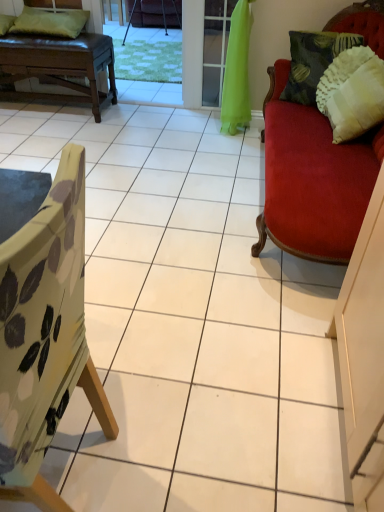
In order to face brown leather bench at upper left, should I rotate leftwards or rightwards?

To face it directly, rotate left by 19.312 degrees.

This screenshot has width=384, height=512. Describe the element at coordinates (129, 22) in the screenshot. I see `metallic tripod at center, which appears as the second chair when ordered from the bottom` at that location.

Measure the distance between green fabric pillow at upper left, which is counted as the 3th pillow, starting from the right, and camera.

3.03 meters.

You are a GUI agent. You are given a task and a screenshot of the screen. Output one action in this format:
    pyautogui.click(x=<x>, y=<y>)
    Task: Click on the brown leather bench at upper left
    Image resolution: width=384 pixels, height=512 pixels.
    Given the screenshot: What is the action you would take?
    pyautogui.click(x=57, y=66)

Is dark green textured pillow at upper right, the second pillow positioned from the left, closer to the viewer compared to floral fabric chair at left, which appears as the first chair when ordered from the bottom?

No.

Is dark green textured pillow at upper right, the second pillow positioned from the right, not near floral fabric chair at left, the 2th chair from the back?

Yes, dark green textured pillow at upper right, the second pillow positioned from the right, and floral fabric chair at left, the 2th chair from the back, are located far from each other.

Looking at their sizes, would you say dark green textured pillow at upper right, the second pillow positioned from the right, is wider or thinner than floral fabric chair at left, the first chair positioned from the front?

In the image, dark green textured pillow at upper right, the second pillow positioned from the right, appears to be more narrow than floral fabric chair at left, the first chair positioned from the front.

From a real-world perspective, is dark green textured pillow at upper right, the second pillow positioned from the left, located beneath floral fabric chair at left, the 2th chair from the back?

Actually, dark green textured pillow at upper right, the second pillow positioned from the left, is physically above floral fabric chair at left, the 2th chair from the back, in the real world.

Which object is positioned more to the right, green fabric screen door at center or green fabric pillow at upper left, which is counted as the 3th pillow, starting from the right?

From the viewer's perspective, green fabric screen door at center appears more on the right side.

Which of these two, green fabric screen door at center or green fabric pillow at upper left, which is counted as the 3th pillow, starting from the right, is smaller?

Smaller between the two is green fabric screen door at center.

Could you tell me if green fabric screen door at center is facing green fabric pillow at upper left, which ranks as the 1th pillow in left-to-right order?

No, green fabric screen door at center is not oriented towards green fabric pillow at upper left, which ranks as the 1th pillow in left-to-right order.

Which object is positioned more to the right, green fabric pillow at upper left, which is counted as the 3th pillow, starting from the right, or metallic tripod at center, the first chair from the back?

→ metallic tripod at center, the first chair from the back.

Is metallic tripod at center, placed as the 2th chair when sorted from front to back, located within green fabric pillow at upper left, which is counted as the 3th pillow, starting from the right?

Actually, metallic tripod at center, placed as the 2th chair when sorted from front to back, is outside green fabric pillow at upper left, which is counted as the 3th pillow, starting from the right.

You are a GUI agent. You are given a task and a screenshot of the screen. Output one action in this format:
    pyautogui.click(x=<x>, y=<y>)
    Task: Click on the chair above the green fabric pillow at upper left, which is counted as the 3th pillow, starting from the right (from the image's perspective)
    The width and height of the screenshot is (384, 512).
    Given the screenshot: What is the action you would take?
    pyautogui.click(x=129, y=22)

Can you tell me how much green fabric pillow at upper left, which is counted as the 3th pillow, starting from the right, and metallic tripod at center, placed as the 2th chair when sorted from front to back, differ in facing direction?

The facing directions of green fabric pillow at upper left, which is counted as the 3th pillow, starting from the right, and metallic tripod at center, placed as the 2th chair when sorted from front to back, are 4.57 degrees apart.

Could you tell me if green fabric screen door at center is turned towards white textured pillow at upper right, the first pillow in the right-to-left sequence?

No, green fabric screen door at center is not aimed at white textured pillow at upper right, the first pillow in the right-to-left sequence.

Are green fabric screen door at center and white textured pillow at upper right, the first pillow in the right-to-left sequence, located far from each other?

They are positioned close to each other.

Based on the photo, does green fabric screen door at center lie behind white textured pillow at upper right, the third pillow positioned from the left?

Yes, green fabric screen door at center is behind white textured pillow at upper right, the third pillow positioned from the left.

Locate an element on the screen. The image size is (384, 512). the 1st pillow above the green fabric screen door at center (from a real-world perspective) is located at coordinates (352, 93).

Which object is positioned more to the left, green fabric screen door at center or metallic tripod at center, the first chair from the back?

metallic tripod at center, the first chair from the back.

Identify the location of chair behind the green fabric screen door at center. The image size is (384, 512). (129, 22).

Considering the sizes of objects green fabric screen door at center and metallic tripod at center, the first chair positioned from the top, in the image provided, who is wider, green fabric screen door at center or metallic tripod at center, the first chair positioned from the top,?

metallic tripod at center, the first chair positioned from the top, is wider.

Is green fabric screen door at center far from metallic tripod at center, the first chair from the back?

green fabric screen door at center is far away from metallic tripod at center, the first chair from the back.

From a real-world perspective, is floral fabric chair at left, which appears as the first chair when ordered from the bottom, positioned above or below brown leather bench at upper left?

In terms of real-world spatial position, floral fabric chair at left, which appears as the first chair when ordered from the bottom, is above brown leather bench at upper left.

What's the angular difference between floral fabric chair at left, the first chair positioned from the front, and brown leather bench at upper left's facing directions?

They differ by 92.1 degrees in their facing directions.

From the image's perspective, would you say floral fabric chair at left, the 2th chair from the back, is shown under brown leather bench at upper left?

Correct, floral fabric chair at left, the 2th chair from the back, appears lower than brown leather bench at upper left in the image.

From the image's perspective, between metallic tripod at center, the first chair positioned from the top, and brown leather bench at upper left, who is located below?

brown leather bench at upper left is shown below in the image.

Is the position of metallic tripod at center, the first chair from the back, more distant than that of brown leather bench at upper left?

Yes, metallic tripod at center, the first chair from the back, is further from the camera.

Between point (176, 15) and point (71, 44), which one is positioned behind?

Point (176, 15)

Is metallic tripod at center, the first chair from the back, bigger or smaller than brown leather bench at upper left?

Clearly, metallic tripod at center, the first chair from the back, is smaller in size than brown leather bench at upper left.

At what (x,y) coordinates should I click in order to perform the action: click on the 2nd chair to the left of the dark green textured pillow at upper right, the second pillow positioned from the left, starting your count from the anchor. Please return your answer as a coordinate pair (x, y). The height and width of the screenshot is (512, 384). Looking at the image, I should click on (45, 335).

I want to click on screen door on the right of green fabric pillow at upper left, which ranks as the 1th pillow in left-to-right order, so click(215, 48).

Looking at the image, which one is located further to white textured pillow at upper right, the first pillow in the right-to-left sequence, floral fabric chair at left, the first chair positioned from the front, or green fabric pillow at upper left, which ranks as the 1th pillow in left-to-right order?

The object further to white textured pillow at upper right, the first pillow in the right-to-left sequence, is green fabric pillow at upper left, which ranks as the 1th pillow in left-to-right order.

Which object lies nearer to the anchor point brown leather bench at upper left, white textured pillow at upper right, the first pillow in the right-to-left sequence, or green fabric pillow at upper left, which is counted as the 3th pillow, starting from the right?

green fabric pillow at upper left, which is counted as the 3th pillow, starting from the right.

Looking at this image, looking at the image, which one is located closer to green fabric screen door at center, metallic tripod at center, placed as the 2th chair when sorted from front to back, or green fabric pillow at upper left, which ranks as the 1th pillow in left-to-right order?

The object closer to green fabric screen door at center is green fabric pillow at upper left, which ranks as the 1th pillow in left-to-right order.

Estimate the real-world distances between objects in this image. Which object is closer to floral fabric chair at left, the first chair positioned from the front, green fabric pillow at upper left, which is counted as the 3th pillow, starting from the right, or green fabric screen door at center?

green fabric screen door at center.

Considering their positions, is dark green textured pillow at upper right, the second pillow positioned from the left, positioned closer to brown leather bench at upper left than green fabric pillow at upper left, which is counted as the 3th pillow, starting from the right?

Among the two, green fabric pillow at upper left, which is counted as the 3th pillow, starting from the right, is located nearer to brown leather bench at upper left.

Which object lies further to the anchor point floral fabric chair at left, placed as the 2th chair when sorted from top to bottom, green fabric screen door at center or brown leather bench at upper left?

brown leather bench at upper left.

Estimate the real-world distances between objects in this image. Which object is closer to dark green textured pillow at upper right, the second pillow positioned from the right, green fabric screen door at center or floral fabric chair at left, which appears as the first chair when ordered from the bottom?

green fabric screen door at center is closer to dark green textured pillow at upper right, the second pillow positioned from the right.

Which object lies nearer to the anchor point white textured pillow at upper right, the third pillow positioned from the left, brown leather bench at upper left or dark green textured pillow at upper right, the second pillow positioned from the right?

dark green textured pillow at upper right, the second pillow positioned from the right, is positioned closer to the anchor white textured pillow at upper right, the third pillow positioned from the left.

You are a GUI agent. You are given a task and a screenshot of the screen. Output one action in this format:
    pyautogui.click(x=<x>, y=<y>)
    Task: Click on the screen door between white textured pillow at upper right, the first pillow in the right-to-left sequence, and metallic tripod at center, placed as the 2th chair when sorted from front to back, in the front-back direction
    This screenshot has height=512, width=384.
    Given the screenshot: What is the action you would take?
    pyautogui.click(x=215, y=48)

Locate an element on the screen. The image size is (384, 512). screen door positioned between dark green textured pillow at upper right, the second pillow positioned from the right, and metallic tripod at center, the first chair from the back, from near to far is located at coordinates (215, 48).

Where is `screen door between brown leather bench at upper left and white textured pillow at upper right, the first pillow in the right-to-left sequence, in the horizontal direction`? Image resolution: width=384 pixels, height=512 pixels. screen door between brown leather bench at upper left and white textured pillow at upper right, the first pillow in the right-to-left sequence, in the horizontal direction is located at coordinates (215, 48).

I want to click on table between floral fabric chair at left, the first chair positioned from the front, and green fabric pillow at upper left, which is counted as the 3th pillow, starting from the right, in the front-back direction, so click(57, 66).